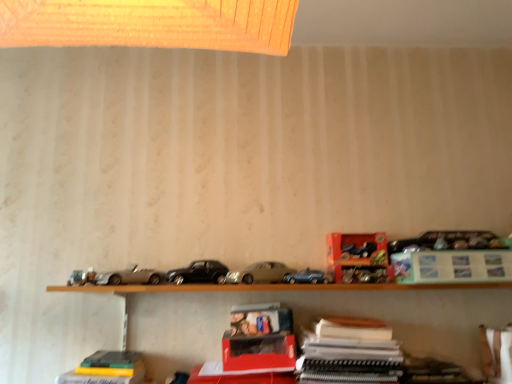
Where is `metallic silver toolbox at center-right, the second toy positioned from the top`? The image size is (512, 384). metallic silver toolbox at center-right, the second toy positioned from the top is located at coordinates (364, 275).

What do you see at coordinates (130, 276) in the screenshot? This screenshot has height=384, width=512. I see `metallic silver car at left, arranged as the first model car when viewed from the left` at bounding box center [130, 276].

Where is `metallic silver toolbox at center-right, the second toy positioned from the top`? metallic silver toolbox at center-right, the second toy positioned from the top is located at coordinates click(x=364, y=275).

Which is more to the right, metallic silver toolbox at center-right, the second toy positioned from the top, or matte silver car at center, acting as the first car starting from the right?

From the viewer's perspective, metallic silver toolbox at center-right, the second toy positioned from the top, appears more on the right side.

From a real-world perspective, is metallic silver toolbox at center-right, the second toy positioned from the top, physically below matte silver car at center, which is the second car from left to right?

Indeed, from a real-world perspective, metallic silver toolbox at center-right, the second toy positioned from the top, is positioned beneath matte silver car at center, which is the second car from left to right.

From the image's perspective, is metallic silver toolbox at center-right, the second toy positioned from the top, located above matte silver car at center, which is the second car from left to right?

Incorrect, from the image's perspective, metallic silver toolbox at center-right, the second toy positioned from the top, is lower than matte silver car at center, which is the second car from left to right.

Considering the sizes of objects metallic silver toolbox at center-right, acting as the 1th toy starting from the bottom, and matte silver car at center, acting as the first car starting from the right, in the image provided, who is wider, metallic silver toolbox at center-right, acting as the 1th toy starting from the bottom, or matte silver car at center, acting as the first car starting from the right,?

matte silver car at center, acting as the first car starting from the right.

In the scene shown: Is matte silver car at center, acting as the first car starting from the right, turned away from green matte paper at upper right, which is the 1th paperback book in top-to-bottom order?

No, matte silver car at center, acting as the first car starting from the right,'s orientation is not away from green matte paper at upper right, which is the 1th paperback book in top-to-bottom order.

Looking at this image, can you confirm if matte silver car at center, acting as the first car starting from the right, is wider than green matte paper at upper right, which is the 1th paperback book in top-to-bottom order?

Indeed, matte silver car at center, acting as the first car starting from the right, has a greater width compared to green matte paper at upper right, which is the 1th paperback book in top-to-bottom order.

The image size is (512, 384). Find the location of `paperback book that is the 1st one when counting forward from the matte silver car at center, which is the second car from left to right`. paperback book that is the 1st one when counting forward from the matte silver car at center, which is the second car from left to right is located at coordinates (452, 266).

Does matte silver car at center, which is the second car from left to right, lie in front of green matte paper at upper right, the 1th paperback book viewed from the right?

No.

Based on their sizes in the image, would you say metallic blue car at center, the first model car when ordered from right to left, is bigger or smaller than metallic silver toolbox at center-right, the second toy positioned from the top?

metallic blue car at center, the first model car when ordered from right to left, is smaller than metallic silver toolbox at center-right, the second toy positioned from the top.

Could you measure the distance between metallic blue car at center, the 2th model car when ordered from left to right, and metallic silver toolbox at center-right, the second toy positioned from the top?

They are 4.71 inches apart.

Considering the sizes of objects metallic blue car at center, the 2th model car when ordered from left to right, and metallic silver toolbox at center-right, the second toy positioned from the top, in the image provided, who is wider, metallic blue car at center, the 2th model car when ordered from left to right, or metallic silver toolbox at center-right, the second toy positioned from the top,?

metallic silver toolbox at center-right, the second toy positioned from the top.

From a real-world perspective, is metallic blue car at center, the 2th model car when ordered from left to right, under metallic silver toolbox at center-right, acting as the 1th toy starting from the bottom?

Yes, from a real-world perspective, metallic blue car at center, the 2th model car when ordered from left to right, is under metallic silver toolbox at center-right, acting as the 1th toy starting from the bottom.

Considering the positions of objects metallic blue car at upper right, which is counted as the 1th toy, starting from the top, and metallic silver car at left, arranged as the first model car when viewed from the left, in the image provided, who is more to the right, metallic blue car at upper right, which is counted as the 1th toy, starting from the top, or metallic silver car at left, arranged as the first model car when viewed from the left,?

metallic blue car at upper right, which is counted as the 1th toy, starting from the top.

Which is further, (345, 240) or (95, 280)?

The point (345, 240) is behind.

From a real-world perspective, is metallic blue car at upper right, marked as the 2th toy in a bottom-to-top arrangement, positioned above or below metallic silver car at left, positioned as the second model car in right-to-left order?

From a real-world perspective, metallic blue car at upper right, marked as the 2th toy in a bottom-to-top arrangement, is physically above metallic silver car at left, positioned as the second model car in right-to-left order.

Considering the sizes of metallic blue car at upper right, marked as the 2th toy in a bottom-to-top arrangement, and metallic silver car at left, arranged as the first model car when viewed from the left, in the image, is metallic blue car at upper right, marked as the 2th toy in a bottom-to-top arrangement, taller or shorter than metallic silver car at left, arranged as the first model car when viewed from the left,?

In the image, metallic blue car at upper right, marked as the 2th toy in a bottom-to-top arrangement, appears to be taller than metallic silver car at left, arranged as the first model car when viewed from the left.

Is metallic blue car at center, the first model car when ordered from right to left, next to black metallic car at center, which is the 1th car from left to right, and touching it?

metallic blue car at center, the first model car when ordered from right to left, is not next to black metallic car at center, which is the 1th car from left to right, and they're not touching.

This screenshot has height=384, width=512. Identify the location of car that is the 2nd one when counting leftward from the metallic blue car at center, the first model car when ordered from right to left. (199, 273).

From the image's perspective, is metallic blue car at center, the 2th model car when ordered from left to right, on black metallic car at center, the second car positioned from the right?

Actually, metallic blue car at center, the 2th model car when ordered from left to right, appears below black metallic car at center, the second car positioned from the right, in the image.

Considering the relative sizes of metallic blue car at center, the 2th model car when ordered from left to right, and black metallic car at center, which is the 1th car from left to right, in the image provided, is metallic blue car at center, the 2th model car when ordered from left to right, thinner than black metallic car at center, which is the 1th car from left to right,?

Yes, metallic blue car at center, the 2th model car when ordered from left to right, is thinner than black metallic car at center, which is the 1th car from left to right.

Would you say metallic blue car at center, the 2th model car when ordered from left to right, is a long distance from green matte paper at upper right, which is the 1th paperback book in top-to-bottom order?

No.

Considering the positions of objects metallic blue car at center, the 2th model car when ordered from left to right, and green matte paper at upper right, which appears as the 2th paperback book when viewed from the left, in the image provided, who is more to the left, metallic blue car at center, the 2th model car when ordered from left to right, or green matte paper at upper right, which appears as the 2th paperback book when viewed from the left,?

metallic blue car at center, the 2th model car when ordered from left to right.

From a real-world perspective, is metallic blue car at center, the first model car when ordered from right to left, physically above green matte paper at upper right, the 1th paperback book viewed from the right?

No, from a real-world perspective, metallic blue car at center, the first model car when ordered from right to left, is not on top of green matte paper at upper right, the 1th paperback book viewed from the right.

How far apart are metallic blue car at center, the first model car when ordered from right to left, and green matte paper at upper right, which is the 1th paperback book in top-to-bottom order?

metallic blue car at center, the first model car when ordered from right to left, is 14.50 inches away from green matte paper at upper right, which is the 1th paperback book in top-to-bottom order.

How different are the orientations of metallic silver toolbox at center-right, acting as the 1th toy starting from the bottom, and metallic silver car at left, positioned as the second model car in right-to-left order, in degrees?

metallic silver toolbox at center-right, acting as the 1th toy starting from the bottom, and metallic silver car at left, positioned as the second model car in right-to-left order, are facing 54.7 degrees away from each other.

From a real-world perspective, who is located higher, metallic silver toolbox at center-right, acting as the 1th toy starting from the bottom, or metallic silver car at left, arranged as the first model car when viewed from the left?

metallic silver toolbox at center-right, acting as the 1th toy starting from the bottom, from a real-world perspective.

From the image's perspective, which is above, metallic silver toolbox at center-right, acting as the 1th toy starting from the bottom, or metallic silver car at left, positioned as the second model car in right-to-left order?

metallic silver car at left, positioned as the second model car in right-to-left order.

Is metallic silver toolbox at center-right, acting as the 1th toy starting from the bottom, thinner than metallic silver car at left, arranged as the first model car when viewed from the left?

Indeed, metallic silver toolbox at center-right, acting as the 1th toy starting from the bottom, has a lesser width compared to metallic silver car at left, arranged as the first model car when viewed from the left.

The image size is (512, 384). I want to click on the 1st toy counting from the right side of the matte silver car at center, acting as the first car starting from the right, so click(x=364, y=275).

Identify the location of paperback book that is above the matte silver car at center, acting as the first car starting from the right (from the image's perspective). (452, 266).

Considering their positions, is hardcover book at lower left positioned closer to metallic silver toolbox at center-right, the second toy positioned from the top, than matte silver car at center, which is the second car from left to right?

The object closer to metallic silver toolbox at center-right, the second toy positioned from the top, is matte silver car at center, which is the second car from left to right.

Looking at the image, which one is located further to green matte paper at upper right, the second paperback book when ordered from bottom to top, metallic blue car at center, the 2th model car when ordered from left to right, or black metallic car at center, the second car positioned from the right?

black metallic car at center, the second car positioned from the right, lies further to green matte paper at upper right, the second paperback book when ordered from bottom to top, than the other object.

Based on their spatial positions, is metallic silver toolbox at center-right, acting as the 1th toy starting from the bottom, or white paper at center, the 1th paperback book ordered from the bottom, further from metallic blue car at center, the first model car when ordered from right to left?

white paper at center, the 1th paperback book ordered from the bottom, is further to metallic blue car at center, the first model car when ordered from right to left.

Looking at the image, which one is located closer to green matte paper at upper right, the second paperback book when ordered from bottom to top, black metallic car at center, which is the 1th car from left to right, or metallic blue car at upper right, marked as the 2th toy in a bottom-to-top arrangement?

metallic blue car at upper right, marked as the 2th toy in a bottom-to-top arrangement, is positioned closer to the anchor green matte paper at upper right, the second paperback book when ordered from bottom to top.

When comparing their distances from hardcover book at lower left, does metallic silver car at left, arranged as the first model car when viewed from the left, or metallic silver toolbox at center-right, acting as the 1th toy starting from the bottom, seem further?

metallic silver toolbox at center-right, acting as the 1th toy starting from the bottom, lies further to hardcover book at lower left than the other object.

Considering their positions, is wooden shelf at lower center positioned further to white paper at center, which is the 1th paperback book in left-to-right order, than metallic blue car at upper right, which is counted as the 1th toy, starting from the top?

wooden shelf at lower center.

Based on their spatial positions, is matte silver car at center, which is the second car from left to right, or metallic silver toolbox at center-right, acting as the 1th toy starting from the bottom, closer to black metallic car at center, the second car positioned from the right?

Based on the image, matte silver car at center, which is the second car from left to right, appears to be nearer to black metallic car at center, the second car positioned from the right.

Looking at the image, which one is located closer to wooden shelf at lower center, black metallic car at center, the second car positioned from the right, or metallic blue car at upper right, marked as the 2th toy in a bottom-to-top arrangement?

Among the two, metallic blue car at upper right, marked as the 2th toy in a bottom-to-top arrangement, is located nearer to wooden shelf at lower center.

Where is `toy located between black metallic car at center, the second car positioned from the right, and metallic blue car at upper right, which is counted as the 1th toy, starting from the top, in the left-right direction`? The width and height of the screenshot is (512, 384). toy located between black metallic car at center, the second car positioned from the right, and metallic blue car at upper right, which is counted as the 1th toy, starting from the top, in the left-right direction is located at coordinates (364, 275).

This screenshot has height=384, width=512. Identify the location of shelf situated between matte silver car at center, acting as the first car starting from the right, and metallic blue car at upper right, marked as the 2th toy in a bottom-to-top arrangement, from left to right. (307, 315).

At what (x,y) coordinates should I click in order to perform the action: click on car situated between black metallic car at center, the second car positioned from the right, and wooden shelf at lower center from left to right. Please return your answer as a coordinate pair (x, y). The width and height of the screenshot is (512, 384). Looking at the image, I should click on (259, 273).

Locate an element on the screen. This screenshot has height=384, width=512. shelf situated between hardcover book at lower left and metallic blue car at upper right, which is counted as the 1th toy, starting from the top, from left to right is located at coordinates (307, 315).